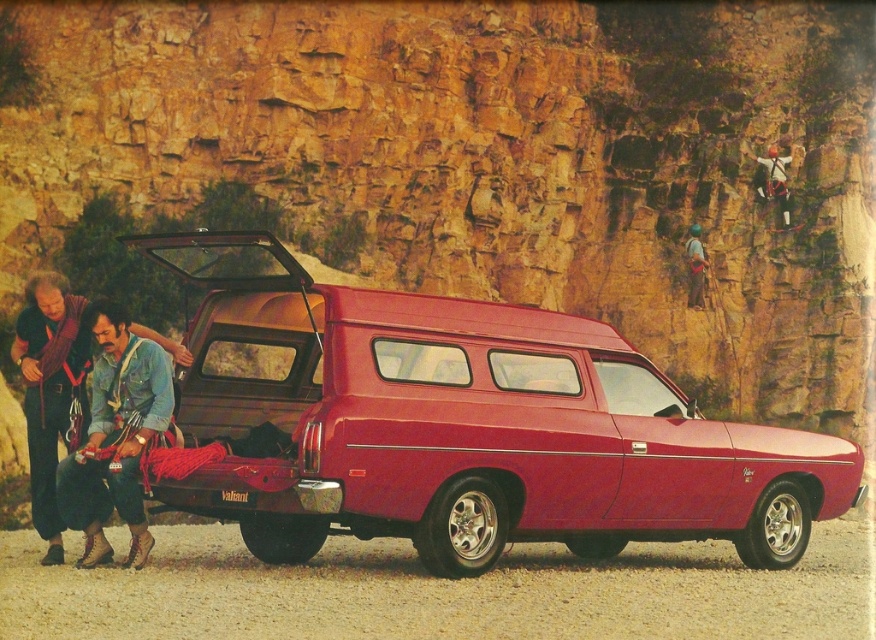
Question: Is denim jacket at lower left below rope climbing gear at upper right?

Choices:
 (A) yes
 (B) no

Answer: (A)

Question: Which object is the closest to the glossy red van at center?

Choices:
 (A) rope climbing gear at upper right
 (B) denim jacket at lower left

Answer: (B)

Question: Among these points, which one is farthest from the camera?

Choices:
 (A) (571, 486)
 (B) (698, 259)

Answer: (B)

Question: Is the position of denim jacket at lower left less distant than that of rope climbing gear at upper right?

Choices:
 (A) no
 (B) yes

Answer: (B)

Question: Is glossy red van at center above denim jacket at lower left?

Choices:
 (A) yes
 (B) no

Answer: (A)

Question: Which object appears closest to the camera in this image?

Choices:
 (A) glossy red van at center
 (B) rope climbing gear at upper right

Answer: (A)